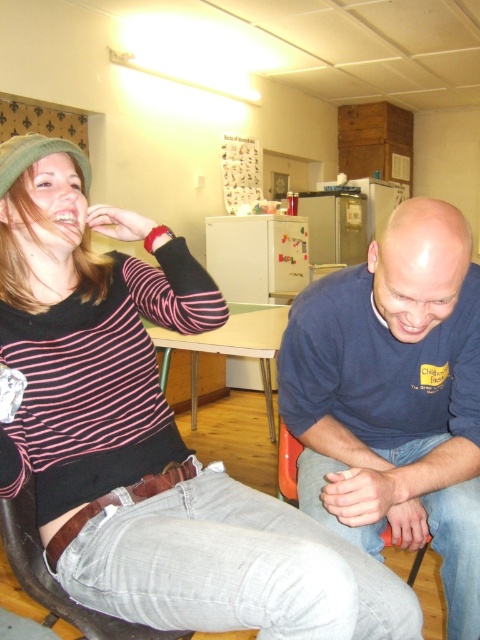
Question: Which of the following is the closest to the observer?

Choices:
 (A) (226, 580)
 (B) (288, 451)
 (C) (84, 636)
 (D) (211, 349)

Answer: (A)

Question: Does striped knit sweater at upper left have a lesser width compared to brown leather chair at lower left?

Choices:
 (A) no
 (B) yes

Answer: (A)

Question: Can you confirm if light brown wooden table at center is thinner than orange plastic chair at lower center?

Choices:
 (A) no
 (B) yes

Answer: (A)

Question: Which is farther from the light brown wooden table at center?

Choices:
 (A) blue cotton shirt at lower right
 (B) orange plastic chair at lower center

Answer: (A)

Question: Which point is closer to the camera?

Choices:
 (A) (463, 356)
 (B) (31, 337)
 (C) (288, 444)
 (D) (230, 337)

Answer: (B)

Question: Can you confirm if brown leather chair at lower left is positioned to the left of light brown wooden table at center?

Choices:
 (A) no
 (B) yes

Answer: (B)